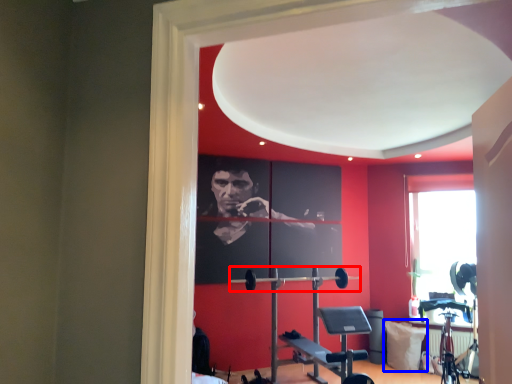
Question: Which of the following is the closest to the observer, barbell (highlighted by a red box) or pillow (highlighted by a blue box)?

Choices:
 (A) barbell
 (B) pillow

Answer: (A)